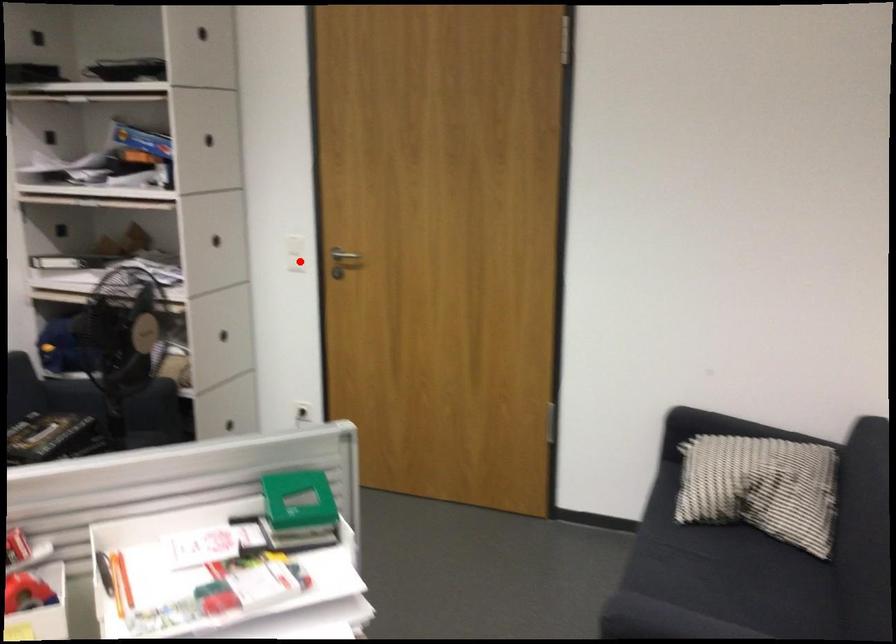
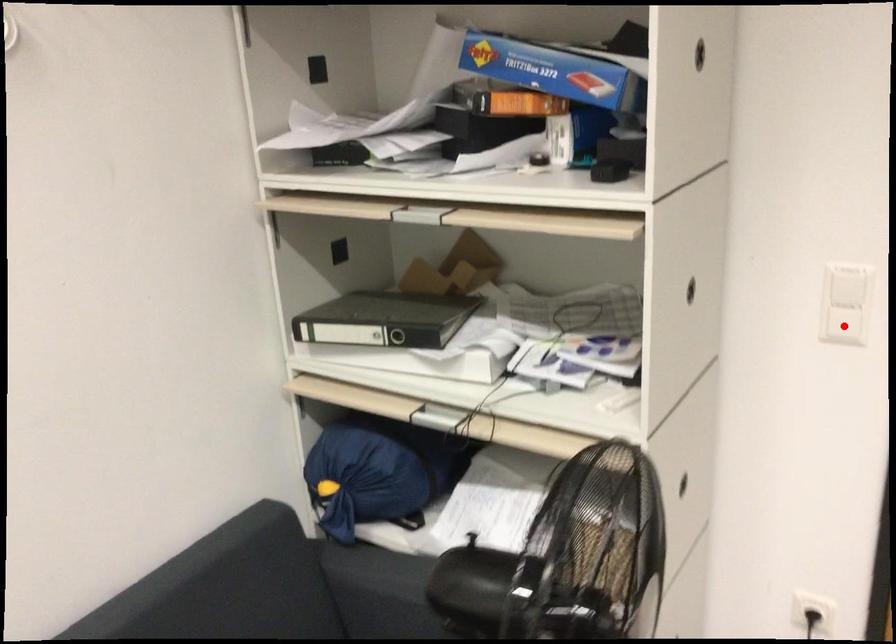
I am providing you with two images of the same scene from different viewpoints. A red point is marked on the first image and another point is marked on the second image. Do the highlighted points in image1 and image2 indicate the same real-world spot?

Yes